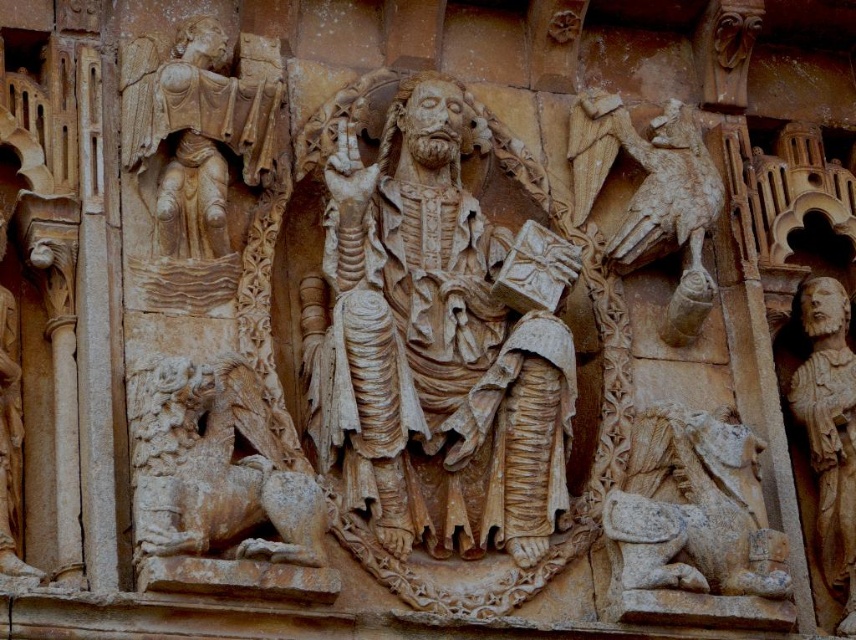
Is point (645, 438) behind point (669, 125)?

That is False.

Is beige stone lion at lower right to the left of carved stone eagle at right from the viewer's perspective?

In fact, beige stone lion at lower right is to the right of carved stone eagle at right.

Does point (663, 509) come behind point (658, 148)?

No, (663, 509) is in front of (658, 148).

Where is `beige stone lion at lower right`? The width and height of the screenshot is (856, 640). beige stone lion at lower right is located at coordinates (694, 508).

Who is more forward, (245,484) or (613,112)?

Point (245,484) is more forward.

Can you confirm if carved stone lion at lower left is taller than carved stone eagle at right?

Incorrect, carved stone lion at lower left's height is not larger of carved stone eagle at right's.

Locate an element on the screen. The height and width of the screenshot is (640, 856). carved stone lion at lower left is located at coordinates (217, 468).

Identify the location of carved stone lion at lower left. The height and width of the screenshot is (640, 856). (217, 468).

Is carved stone figure at center to the left of beige stone lion at lower right from the viewer's perspective?

Indeed, carved stone figure at center is positioned on the left side of beige stone lion at lower right.

Can you confirm if carved stone figure at center is bigger than beige stone lion at lower right?

Correct, carved stone figure at center is larger in size than beige stone lion at lower right.

The width and height of the screenshot is (856, 640). Identify the location of carved stone figure at center. (432, 342).